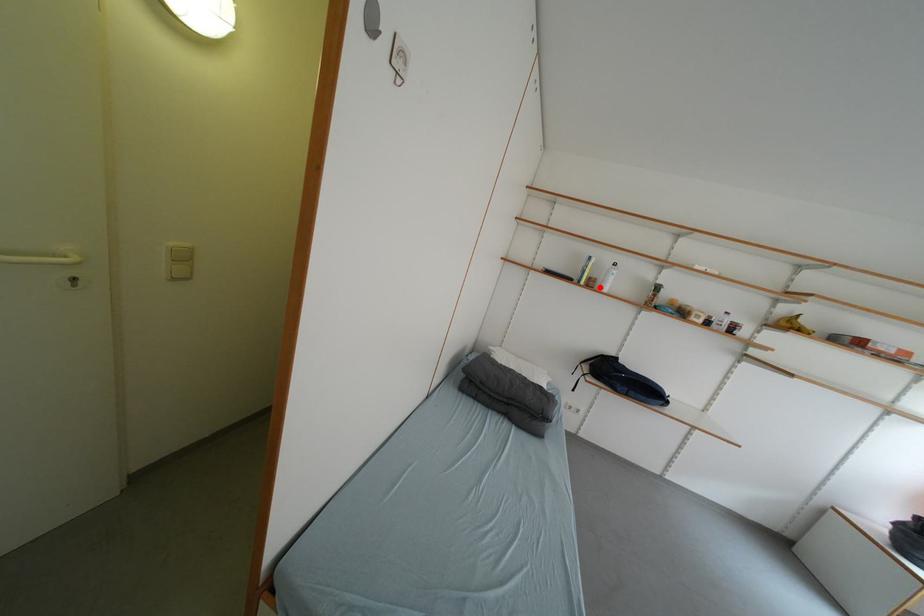
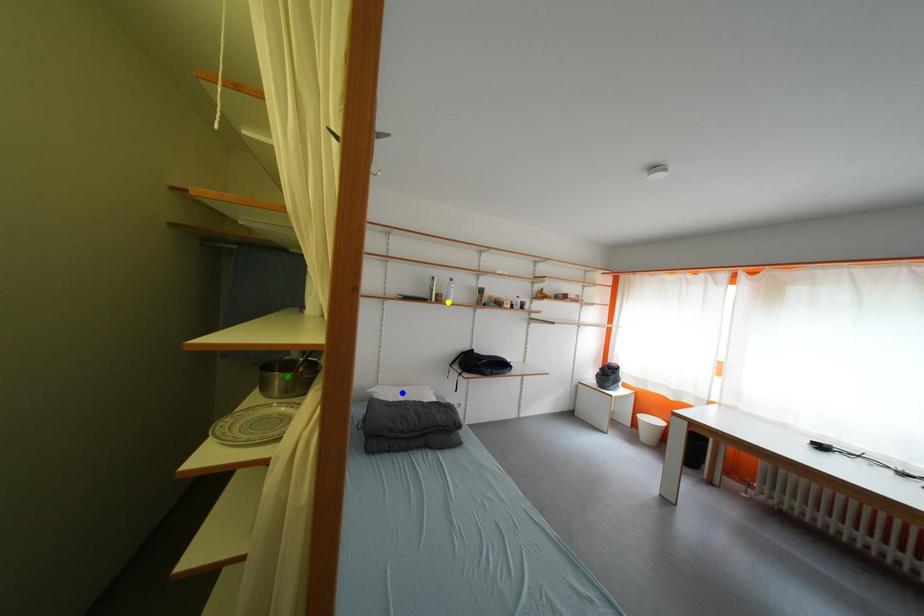
Question: I am providing you with two images of the same scene from different viewpoints. A red point is marked on the first image. You are given multiple points on the second image. Which point in image 2 represents the same 3d spot as the red point in image 1?

Choices:
 (A) green point
 (B) blue point
 (C) yellow point

Answer: (C)